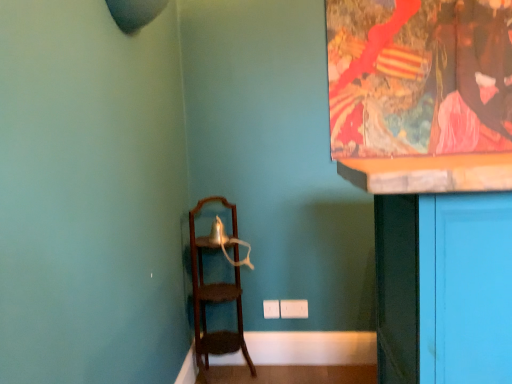
Question: Is wooden ladder at left situated inside wooden frame at upper right or outside?

Choices:
 (A) outside
 (B) inside

Answer: (A)

Question: In the image, is wooden ladder at left on the left side or the right side of wooden frame at upper right?

Choices:
 (A) right
 (B) left

Answer: (B)

Question: Relative to wooden frame at upper right, is wooden ladder at left in front or behind?

Choices:
 (A) behind
 (B) front

Answer: (B)

Question: Considering the positions of wooden frame at upper right and wooden ladder at left in the image, is wooden frame at upper right taller or shorter than wooden ladder at left?

Choices:
 (A) short
 (B) tall

Answer: (A)

Question: From a real-world perspective, is wooden frame at upper right positioned above or below wooden ladder at left?

Choices:
 (A) below
 (B) above

Answer: (B)

Question: In terms of width, does wooden frame at upper right look wider or thinner when compared to wooden ladder at left?

Choices:
 (A) thin
 (B) wide

Answer: (A)

Question: Do you think wooden frame at upper right is within wooden ladder at left, or outside of it?

Choices:
 (A) outside
 (B) inside

Answer: (A)